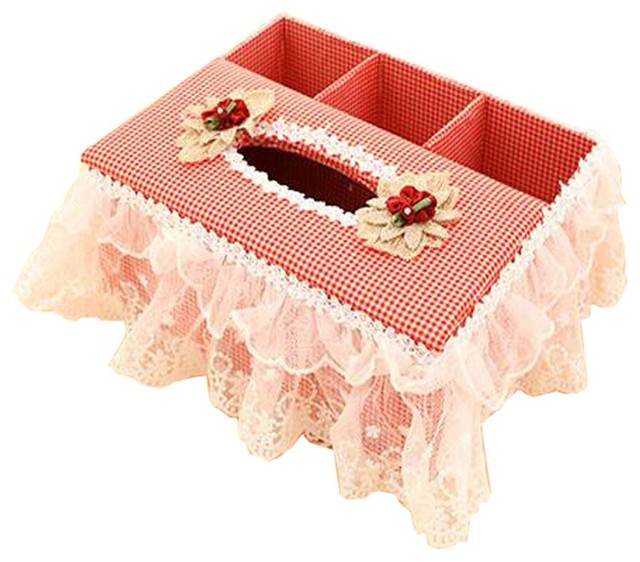
The image size is (640, 562). Find the location of `cushion`. cushion is located at coordinates (140, 173).